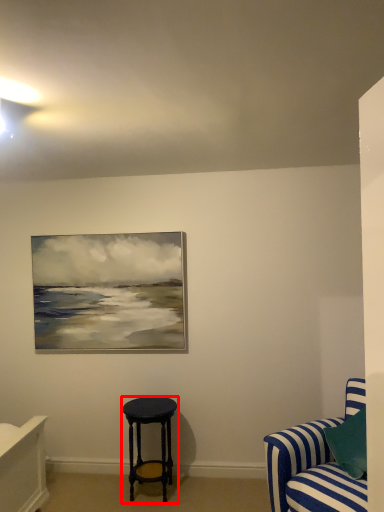
Question: In this image, where is stool (annotated by the red box) located relative to studio couch?

Choices:
 (A) left
 (B) right

Answer: (A)